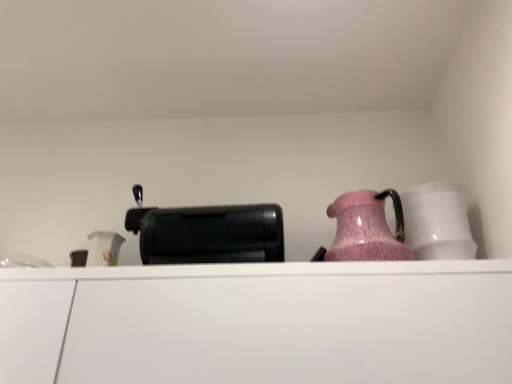
Question: From a real-world perspective, is black plastic toaster at center on white matte cabinet at center?

Choices:
 (A) no
 (B) yes

Answer: (B)

Question: From the image's perspective, is black plastic toaster at center below white matte cabinet at center?

Choices:
 (A) yes
 (B) no

Answer: (B)

Question: Is black plastic toaster at center to the right of white matte cabinet at center from the viewer's perspective?

Choices:
 (A) yes
 (B) no

Answer: (B)

Question: Can you confirm if black plastic toaster at center is smaller than white matte cabinet at center?

Choices:
 (A) no
 (B) yes

Answer: (B)

Question: Is black plastic toaster at center not within white matte cabinet at center?

Choices:
 (A) yes
 (B) no

Answer: (A)

Question: Do you think pink glossy jug at upper right is within black plastic toaster at center, or outside of it?

Choices:
 (A) inside
 (B) outside

Answer: (B)

Question: From the image's perspective, is pink glossy jug at upper right above or below black plastic toaster at center?

Choices:
 (A) below
 (B) above

Answer: (B)

Question: Visually, is pink glossy jug at upper right positioned to the left or to the right of black plastic toaster at center?

Choices:
 (A) left
 (B) right

Answer: (B)

Question: In the image, is pink glossy jug at upper right positioned in front of or behind black plastic toaster at center?

Choices:
 (A) behind
 (B) front

Answer: (B)

Question: Looking at the image, does white glossy mug at right seem bigger or smaller compared to black plastic toaster at center?

Choices:
 (A) big
 (B) small

Answer: (B)

Question: From the image's perspective, is white glossy mug at right located above or below black plastic toaster at center?

Choices:
 (A) below
 (B) above

Answer: (B)

Question: From their relative heights in the image, would you say white glossy mug at right is taller or shorter than black plastic toaster at center?

Choices:
 (A) short
 (B) tall

Answer: (B)

Question: Does point (435, 230) appear closer or farther from the camera than point (181, 211)?

Choices:
 (A) farther
 (B) closer

Answer: (A)

Question: Visually, is black plastic toaster at center positioned to the left or to the right of white matte cabinet at center?

Choices:
 (A) right
 (B) left

Answer: (B)

Question: In terms of size, does black plastic toaster at center appear bigger or smaller than white matte cabinet at center?

Choices:
 (A) small
 (B) big

Answer: (A)